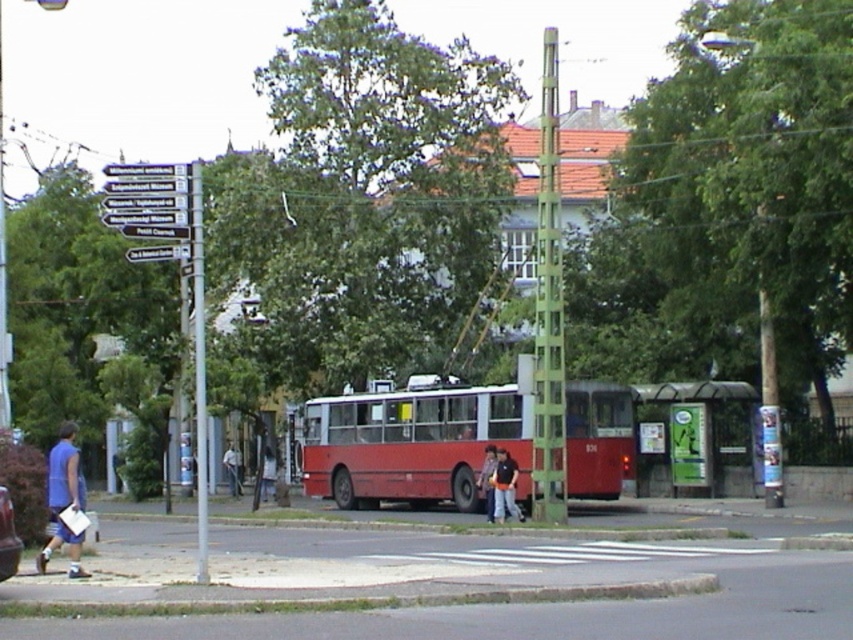
You are a delivery person who needs to drop off a package at the green plastic bus stop at center. The GPS coordinates show that the bus stop is at point 0.684, 0.819. If you are currently at point 0.5, 0.5, which direction should you move to reach the bus stop?

The green plastic bus stop at center is located at point (698, 436). Since your current position is (426, 320), you should move northeast to reach it.

You are a delivery drone trying to land on the gray concrete curb at lower center. The landing coordinates must be within a 0.1 meter radius of the curb. Given that the curb is at point 0.939, 0.431, can you land safely?

The gray concrete curb at lower center is at point (367, 600), so yes, the drone can land safely within the 0.1 meter radius around the curb.

In the scene shown: You are a delivery person standing at the bus stop and need to place a package on the gray concrete curb at lower center. However, you also have a matte black jacket at center nearby. Which object is smaller in size and suitable for placing the package?

The gray concrete curb at lower center has a smaller size compared to the matte black jacket at center. Therefore, the matte black jacket at center is larger and more suitable for placing the package.